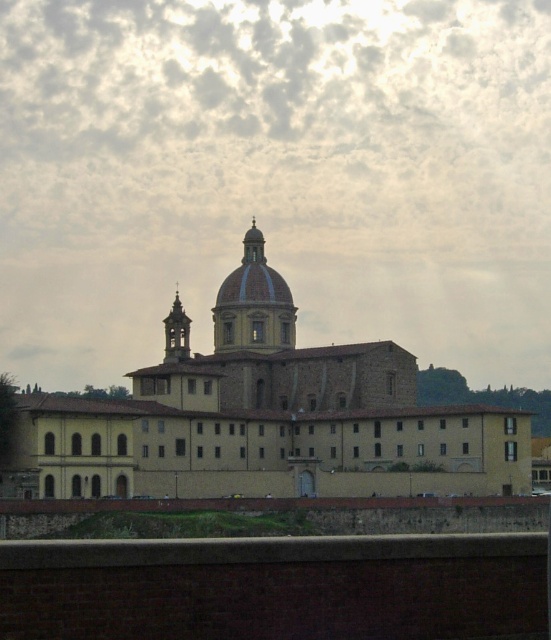
You are standing in front of a historic building and notice the cloudy sky at upper center and the matte brown dome at center. Which one appears wider from your perspective?

The cloudy sky at upper center appears wider than the matte brown dome at center because its width is larger according to the description.

You are a maintenance worker needing to inspect both the matte brown dome at center and the gold textured bell tower at center. Given that your ladder is 8 meters long, can you safely move the ladder between them without it touching either structure?

The distance between the matte brown dome at center and the gold textured bell tower at center is 7.79 meters. Since the ladder is 8 meters long, it can be positioned between them without touching either structure, as the ladder is slightly longer than the distance separating the two structures.